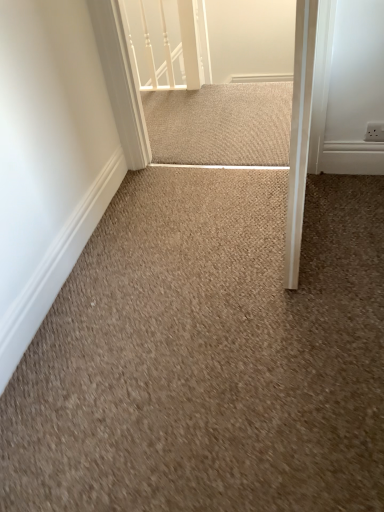
In order to face beige textured mat at center, should I rotate leftwards or rightwards?

It's best to rotate left around 0.603 degrees.

Looking at this image, measure the distance between point (139, 73) and camera.

The depth of point (139, 73) is 2.86 meters.

Locate an element on the screen. Image resolution: width=384 pixels, height=512 pixels. beige textured mat at center is located at coordinates (221, 124).

Identify the location of granite lying in front of the white glossy rail at upper center. (208, 355).

From the image's perspective, which is below, white glossy rail at upper center or beige carpet at center?

beige carpet at center.

Who is bigger, white glossy rail at upper center or beige carpet at center?

With larger size is beige carpet at center.

Is white glossy rail at upper center not within beige carpet at center?

Yes, white glossy rail at upper center is outside of beige carpet at center.

Between point (204, 149) and point (118, 479), which one is positioned in front?

The point (118, 479) is more forward.

Between beige textured mat at center and beige carpet at center, which one has smaller size?

With smaller size is beige textured mat at center.

In the image, is beige textured mat at center positioned in front of or behind beige carpet at center?

Visually, beige textured mat at center is located behind beige carpet at center.

Is beige textured mat at center directly adjacent to beige carpet at center?

beige textured mat at center is not next to beige carpet at center, and they're not touching.

Looking at the image, does beige textured mat at center seem bigger or smaller compared to white glossy rail at upper center?

beige textured mat at center is smaller than white glossy rail at upper center.

Relative to white glossy rail at upper center, is beige textured mat at center in front or behind?

beige textured mat at center is positioned closer to the viewer than white glossy rail at upper center.

Can you confirm if beige textured mat at center is shorter than white glossy rail at upper center?

Indeed, beige textured mat at center has a lesser height compared to white glossy rail at upper center.

Considering the relative sizes of white glossy rail at upper center and beige textured mat at center in the image provided, is white glossy rail at upper center taller than beige textured mat at center?

Correct, white glossy rail at upper center is much taller as beige textured mat at center.

Is white glossy rail at upper center wider than beige textured mat at center?

Incorrect, the width of white glossy rail at upper center does not surpass that of beige textured mat at center.

Is white glossy rail at upper center facing towards beige textured mat at center?

Yes, white glossy rail at upper center is aimed at beige textured mat at center.

How different are the orientations of white glossy rail at upper center and beige textured mat at center in degrees?

There is a 0.758-degree angle between the facing directions of white glossy rail at upper center and beige textured mat at center.

Is point (351, 179) positioned behind point (174, 125)?

No, it is not.

Consider the image. Looking at the image, does beige carpet at center seem bigger or smaller compared to beige textured mat at center?

beige carpet at center is bigger than beige textured mat at center.

Is beige carpet at center in front of or behind beige textured mat at center in the image?

Visually, beige carpet at center is located in front of beige textured mat at center.

Considering the sizes of objects beige carpet at center and beige textured mat at center in the image provided, who is thinner, beige carpet at center or beige textured mat at center?

beige textured mat at center is thinner.

Consider the image. From a real-world perspective, is beige carpet at center below white glossy rail at upper center?

Indeed, from a real-world perspective, beige carpet at center is positioned beneath white glossy rail at upper center.

Is beige carpet at center oriented towards white glossy rail at upper center?

No, beige carpet at center is not turned towards white glossy rail at upper center.

Who is taller, beige carpet at center or white glossy rail at upper center?

With more height is white glossy rail at upper center.

From the image's perspective, is beige carpet at center below white glossy rail at upper center?

Correct, beige carpet at center appears lower than white glossy rail at upper center in the image.

Identify the location of rail above the beige carpet at center (from a real-world perspective). The image size is (384, 512). (164, 42).

This screenshot has height=512, width=384. In order to click on granite located underneath the beige textured mat at center (from a real-world perspective) in this screenshot , I will do `click(208, 355)`.

Looking at the image, which one is located further to white glossy rail at upper center, beige carpet at center or beige textured mat at center?

beige carpet at center lies further to white glossy rail at upper center than the other object.

Looking at the image, which one is located further to beige textured mat at center, beige carpet at center or white glossy rail at upper center?

Based on the image, beige carpet at center appears to be further to beige textured mat at center.

When comparing their distances from beige carpet at center, does white glossy rail at upper center or beige textured mat at center seem further?

white glossy rail at upper center is positioned further to the anchor beige carpet at center.

Which object lies further to the anchor point white glossy rail at upper center, beige textured mat at center or beige carpet at center?

Based on the image, beige carpet at center appears to be further to white glossy rail at upper center.

Looking at this image, when comparing their distances from beige carpet at center, does beige textured mat at center or white glossy rail at upper center seem closer?

The object closer to beige carpet at center is beige textured mat at center.

Consider the image. From the image, which object appears to be farther from beige textured mat at center, white glossy rail at upper center or beige carpet at center?

Based on the image, beige carpet at center appears to be further to beige textured mat at center.

At what (x,y) coordinates should I click in order to perform the action: click on doormat between beige carpet at center and white glossy rail at upper center along the z-axis. Please return your answer as a coordinate pair (x, y). The image size is (384, 512). Looking at the image, I should click on (221, 124).